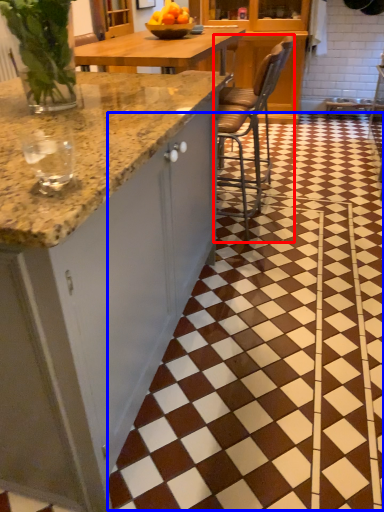
Question: Which point is closer to the camera, chair (highlighted by a red box) or tile (highlighted by a blue box)?

Choices:
 (A) chair
 (B) tile

Answer: (B)